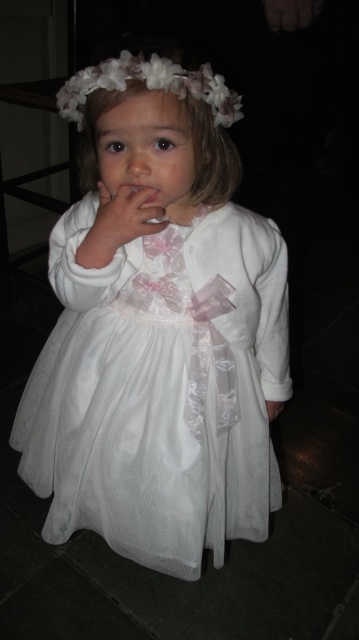
Question: Which point is farther to the camera?

Choices:
 (A) (118, 88)
 (B) (142, 204)
 (C) (282, 404)
 (D) (122, 333)

Answer: (C)

Question: Considering the relative positions of white silky hair at center and white satin hand at lower center in the image provided, where is white silky hair at center located with respect to white satin hand at lower center?

Choices:
 (A) left
 (B) right

Answer: (A)

Question: Can you confirm if white silky hair at center is wider than matte white hand at center?

Choices:
 (A) no
 (B) yes

Answer: (B)

Question: Does matte white hand at center have a larger size compared to white satin hand at lower center?

Choices:
 (A) yes
 (B) no

Answer: (A)

Question: Which object is the farthest from the white satin hand at lower center?

Choices:
 (A) white satin dress at center
 (B) fluffy white flower at upper center

Answer: (B)

Question: Which object is the closest to the white satin dress at center?

Choices:
 (A) white satin hand at lower center
 (B) fluffy white flower at upper center
 (C) matte white hand at center
 (D) white silky hair at center

Answer: (D)